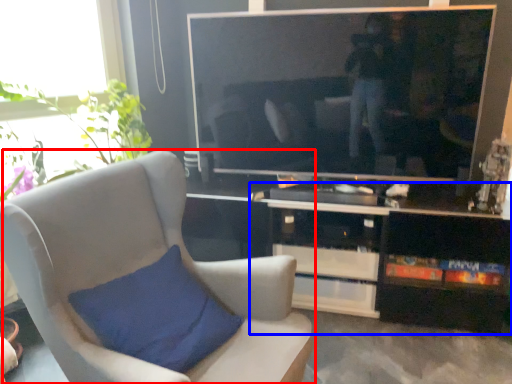
Question: Which object is further to the camera taking this photo, chair (highlighted by a red box) or cabinetry (highlighted by a blue box)?

Choices:
 (A) chair
 (B) cabinetry

Answer: (B)